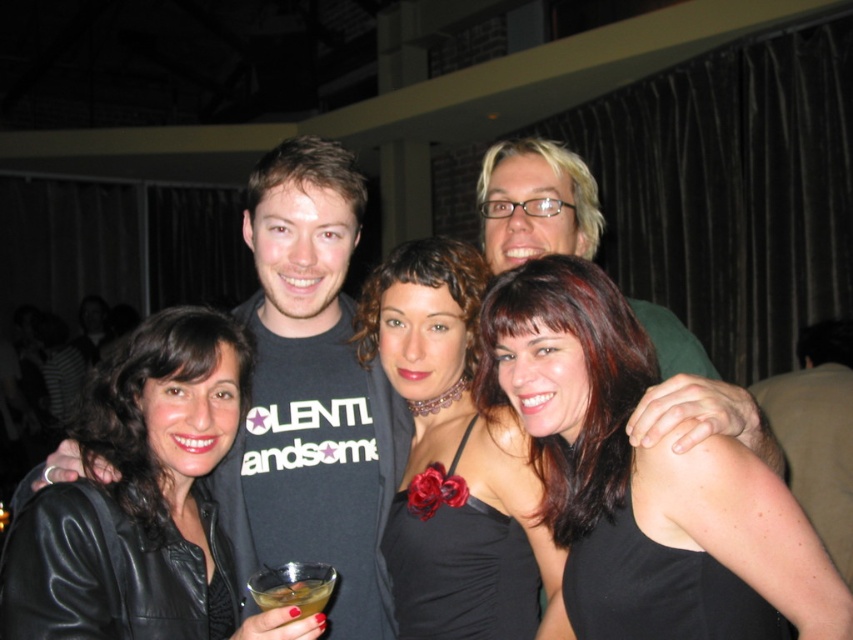
You are a photographer at the event and need to adjust the lighting to highlight both the shiny black dress at center and the black satin dress at center. Since both dresses are in the center, how can you determine which one is closer to the camera?

The shiny black dress at center is below the black satin dress at center, so the black satin dress at center is closer to the camera because it appears above the other dress.

You are planning to wear both the leather jacket at left and the black satin dress at center to an event. Based on the image, which item has a wider silhouette?

The leather jacket at left has a wider silhouette than the black satin dress at center because its width is larger.

You are planning to attend a formal event and have both the shiny black dress at center and the black satin dress at center in your wardrobe. Based on the image description, which dress would you choose if you want a wider silhouette?

The shiny black dress at center has a larger width than the black satin dress at center, so it would provide a wider silhouette for the formal event.